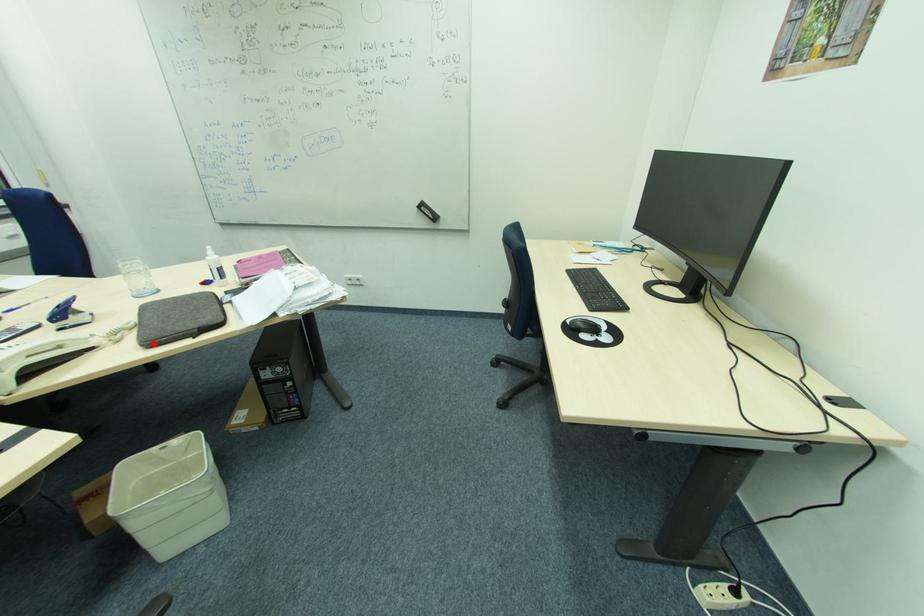
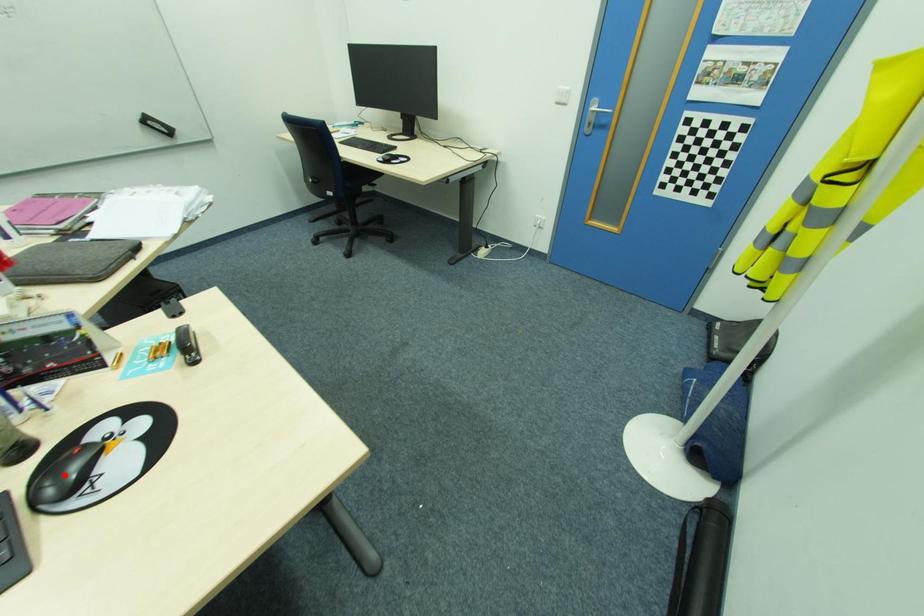
I am providing you with two images of the same scene from different viewpoints. A red point is marked on the first image and another point is marked on the second image. Does the point marked in image1 correspond to the same location as the one in image2?

No